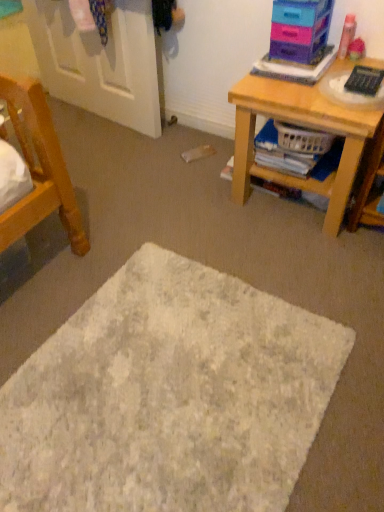
Question: From the image's perspective, does plastic storage drawers at upper right appear lower than white textured mat at center?

Choices:
 (A) no
 (B) yes

Answer: (A)

Question: Are plastic storage drawers at upper right and white textured mat at center located far from each other?

Choices:
 (A) yes
 (B) no

Answer: (A)

Question: Does plastic storage drawers at upper right come behind white textured mat at center?

Choices:
 (A) no
 (B) yes

Answer: (B)

Question: From the image's perspective, is plastic storage drawers at upper right on white textured mat at center?

Choices:
 (A) no
 (B) yes

Answer: (B)

Question: Does plastic storage drawers at upper right have a larger size compared to white textured mat at center?

Choices:
 (A) yes
 (B) no

Answer: (B)

Question: Could you tell me if plastic storage drawers at upper right is turned towards white textured mat at center?

Choices:
 (A) no
 (B) yes

Answer: (A)

Question: Is black plastic remote control at upper right behind white painted wood door at upper left?

Choices:
 (A) no
 (B) yes

Answer: (A)

Question: Does black plastic remote control at upper right have a greater width compared to white painted wood door at upper left?

Choices:
 (A) no
 (B) yes

Answer: (B)

Question: Are black plastic remote control at upper right and white painted wood door at upper left far apart?

Choices:
 (A) no
 (B) yes

Answer: (B)

Question: Does black plastic remote control at upper right have a larger size compared to white painted wood door at upper left?

Choices:
 (A) no
 (B) yes

Answer: (A)

Question: Is black plastic remote control at upper right turned away from white painted wood door at upper left?

Choices:
 (A) yes
 (B) no

Answer: (B)

Question: Is black plastic remote control at upper right positioned beyond the bounds of white painted wood door at upper left?

Choices:
 (A) no
 (B) yes

Answer: (B)

Question: Does wooden desk at right have a lesser height compared to white textured mat at center?

Choices:
 (A) yes
 (B) no

Answer: (B)